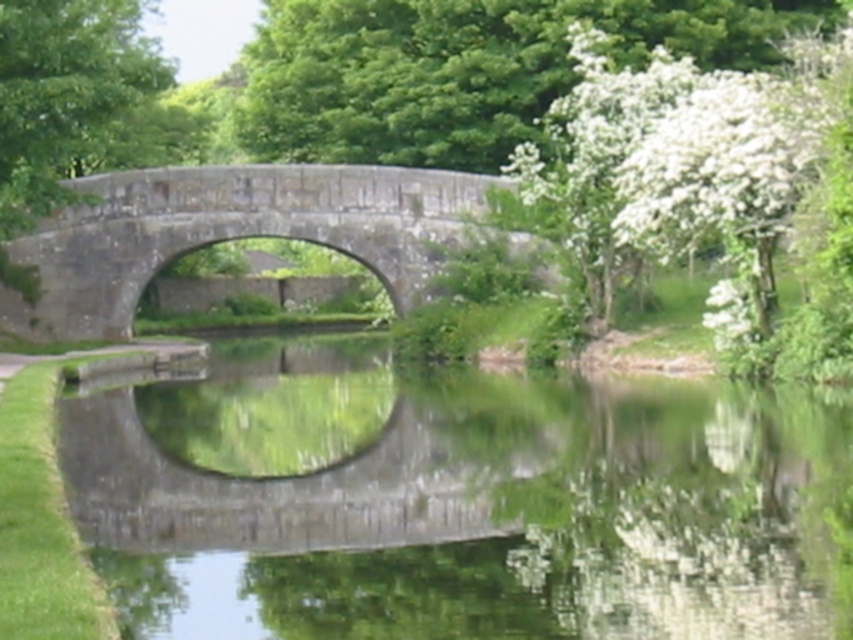
Consider the image. You are standing on the stone bridge and looking at the two points marked in the image. Which point, point (566, 561) or point (263, 52), is closer to you?

Point (566, 561) is closer to the viewer than point (263, 52).

You are standing on the stone bridge at center and want to see the green reflective water at center. Which direction should you look to see the water first?

The green reflective water at center is closer to the viewer than the stone bridge at center, so you should look downward to see the water first.

You are standing on the stone bridge at center and want to cross to the other side. The green reflective water at center flows beneath you. Considering the width of the water and the bridge, which one is wider?

The green reflective water at center is wider than the stone bridge at center according to the description.